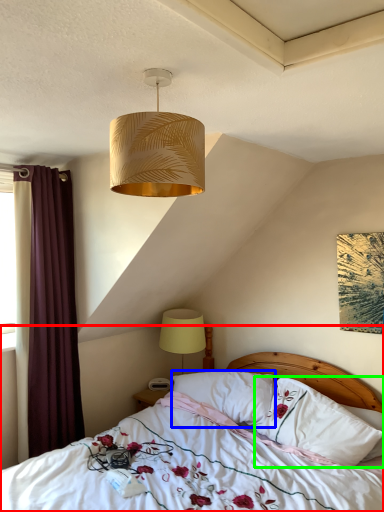
Question: Which object is the farthest from bed (highlighted by a red box)? Choose among these: pillow (highlighted by a blue box) or pillow (highlighted by a green box).

Choices:
 (A) pillow
 (B) pillow

Answer: (A)